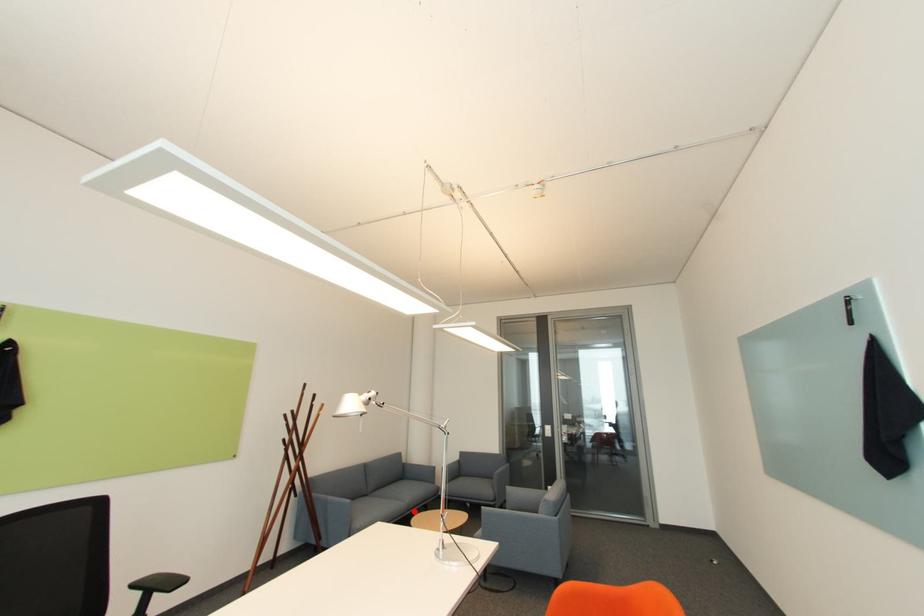
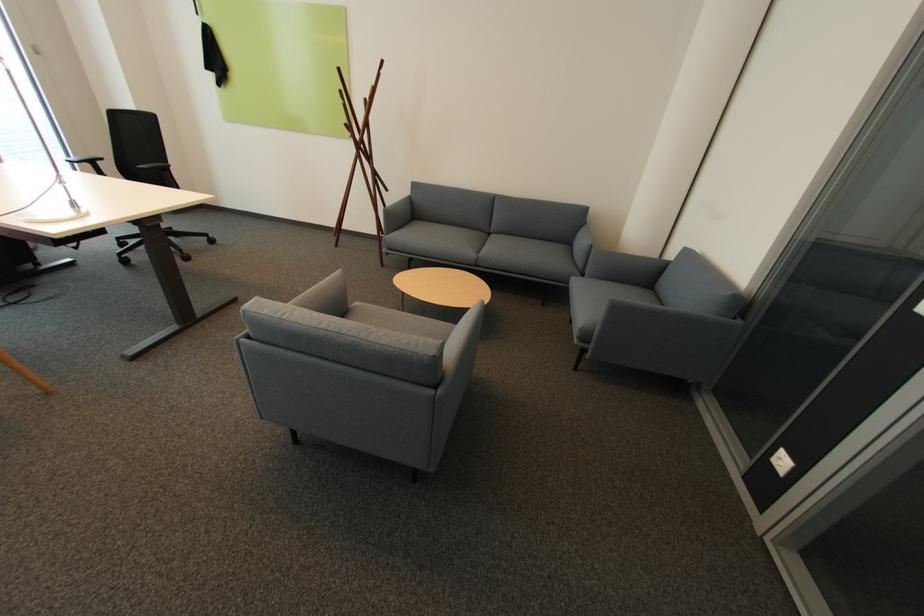
Find the pixel in the second image that matches the highlighted location in the first image.

(482, 265)